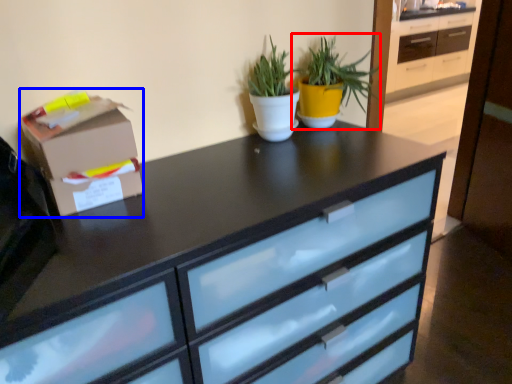
Question: Among these objects, which one is farthest to the camera, houseplant (highlighted by a red box) or cardboard box (highlighted by a blue box)?

Choices:
 (A) houseplant
 (B) cardboard box

Answer: (A)